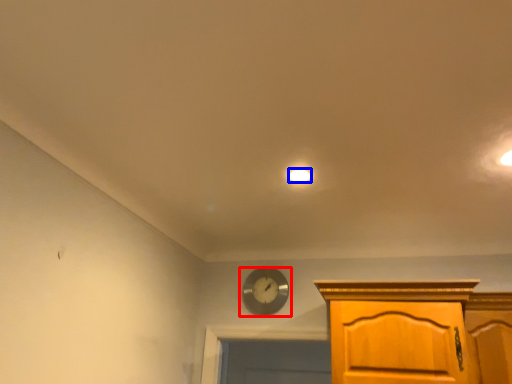
Question: Which point is further to the camera, wall clock (highlighted by a red box) or lighting (highlighted by a blue box)?

Choices:
 (A) wall clock
 (B) lighting

Answer: (A)